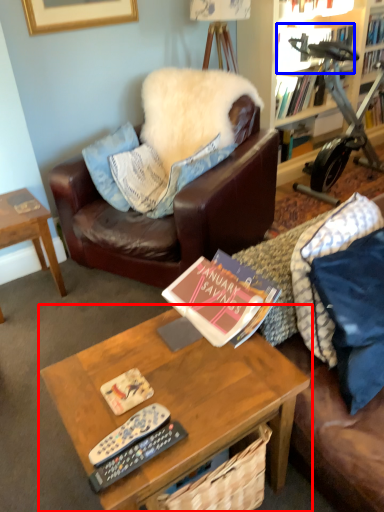
Question: Among these objects, which one is farthest to the camera, coffee table (highlighted by a red box) or book (highlighted by a blue box)?

Choices:
 (A) coffee table
 (B) book

Answer: (B)